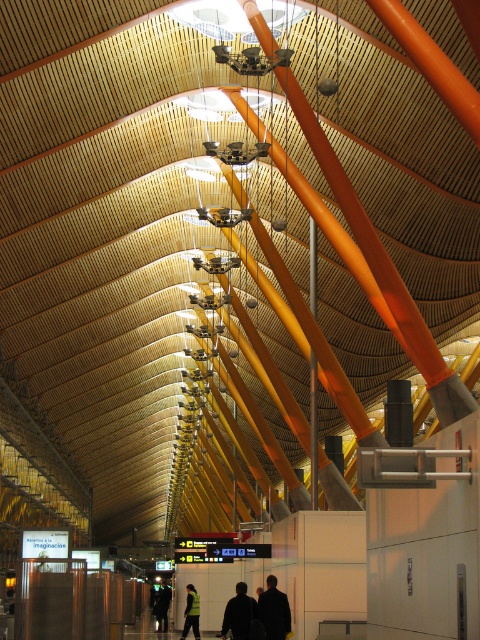
Question: Does dark brown leather jacket at center have a smaller size compared to reflective yellow vest at center?

Choices:
 (A) no
 (B) yes

Answer: (A)

Question: From the image, what is the correct spatial relationship of dark brown leather jacket at center in relation to dark green jacket at center?

Choices:
 (A) right
 (B) left

Answer: (A)

Question: Which of the following is the farthest from the observer?

Choices:
 (A) dark green jacket at center
 (B) dark fabric jacket at center
 (C) orange glossy beam at upper center
 (D) dark brown leather jacket at center

Answer: (A)

Question: Based on their relative distances, which object is farther from the dark fabric jacket at center?

Choices:
 (A) orange glossy beam at upper center
 (B) dark brown leather jacket at center
 (C) reflective yellow vest at center
 (D) dark green jacket at center

Answer: (D)

Question: Can you confirm if dark fabric jacket at center is wider than reflective yellow vest at center?

Choices:
 (A) yes
 (B) no

Answer: (A)

Question: Which of these objects is positioned closest to the dark green jacket at center?

Choices:
 (A) orange glossy beam at upper center
 (B) reflective yellow vest at center
 (C) dark brown leather jacket at center
 (D) dark fabric jacket at center

Answer: (B)